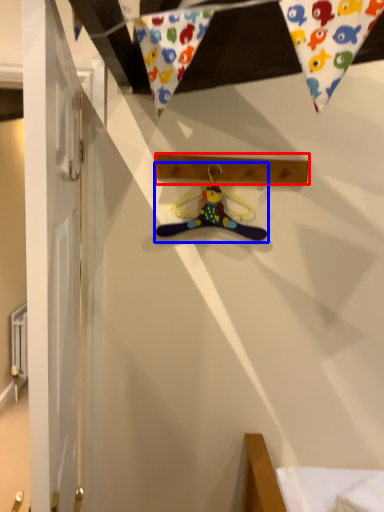
Question: Which object appears closest to the camera in this image, plank (highlighted by a red box) or hanger (highlighted by a blue box)?

Choices:
 (A) plank
 (B) hanger

Answer: (A)